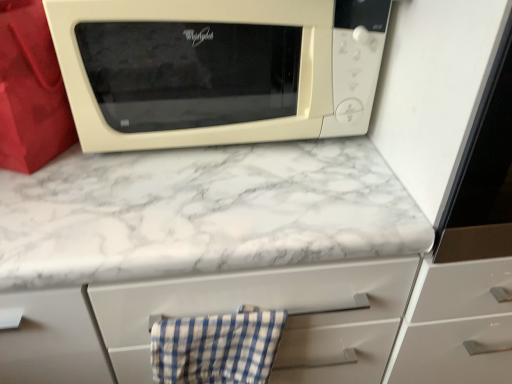
Question: Looking at the image, does white marble countertop at upper center seem bigger or smaller compared to blue checkered cloth at lower center?

Choices:
 (A) big
 (B) small

Answer: (A)

Question: In the image, is white marble countertop at upper center positioned in front of or behind blue checkered cloth at lower center?

Choices:
 (A) behind
 (B) front

Answer: (B)

Question: Based on their relative distances, which object is nearer to the white marble countertop at upper center?

Choices:
 (A) beige matte microwave at upper center
 (B) blue checkered cloth at lower center

Answer: (A)

Question: Which object is positioned closest to the blue checkered cloth at lower center?

Choices:
 (A) white marble countertop at upper center
 (B) beige matte microwave at upper center

Answer: (A)